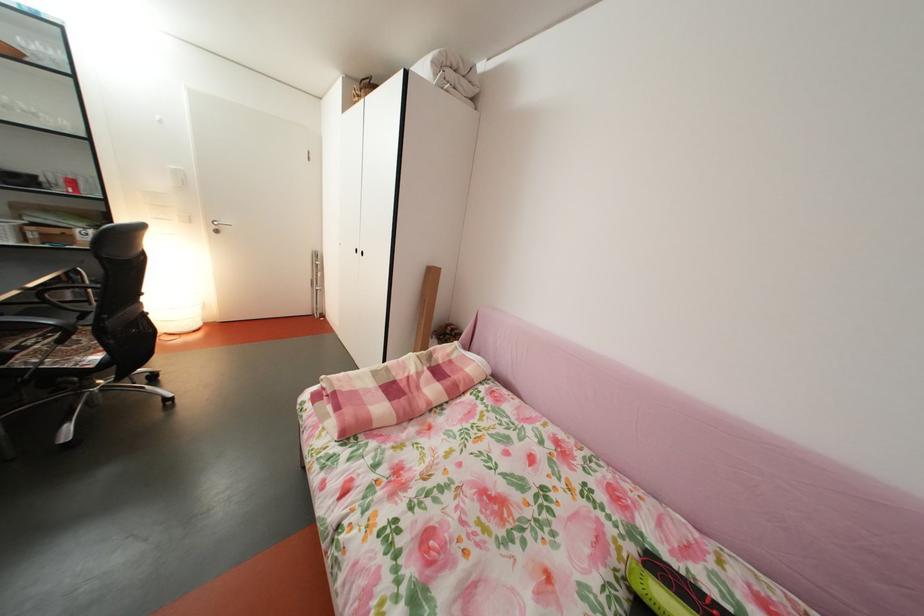
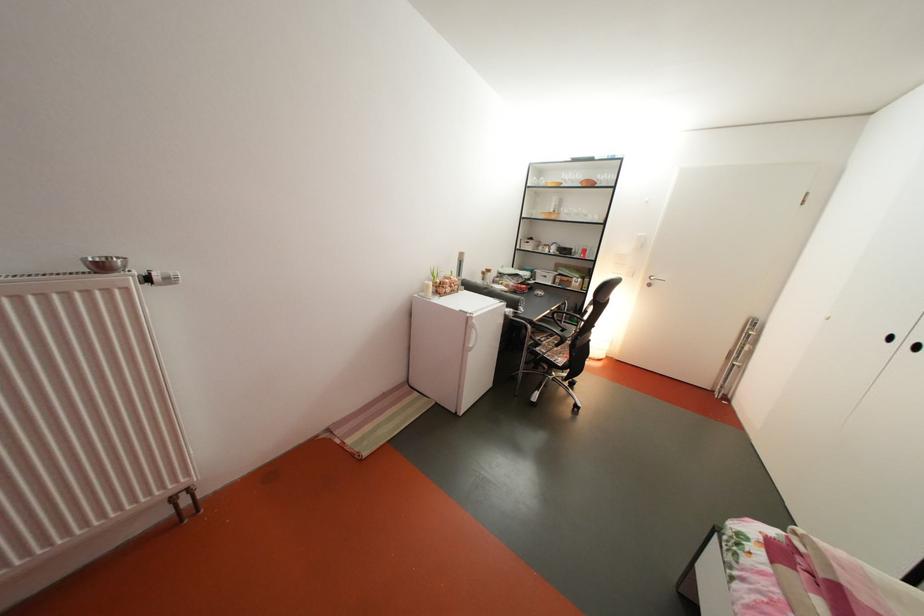
The point at (100, 307) is marked in the first image. Where is the corresponding point in the second image?

(573, 328)